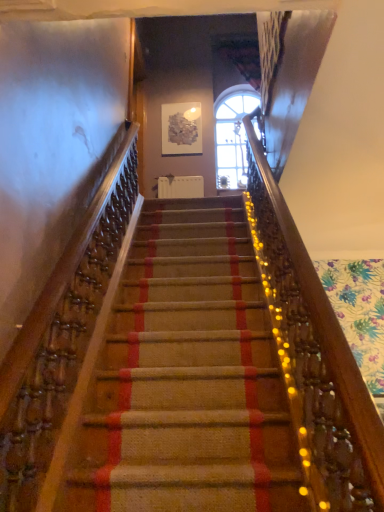
What is the approximate width of metallic textured artwork at upper center?

metallic textured artwork at upper center is 1.39 inches wide.

What do you see at coordinates (181, 128) in the screenshot?
I see `metallic textured artwork at upper center` at bounding box center [181, 128].

Locate an element on the screen. This screenshot has height=512, width=384. metallic textured artwork at upper center is located at coordinates (181, 128).

The image size is (384, 512). Identify the location of metallic textured artwork at upper center. (181, 128).